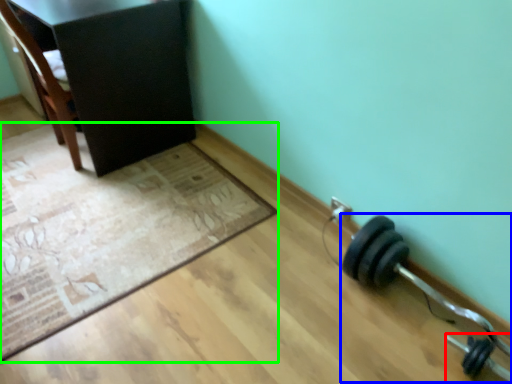
Question: Based on their relative distances, which object is farther from dumbbell (highlighted by a red box)? Choose from dumbbell (highlighted by a blue box) and mat (highlighted by a green box).

Choices:
 (A) dumbbell
 (B) mat

Answer: (B)